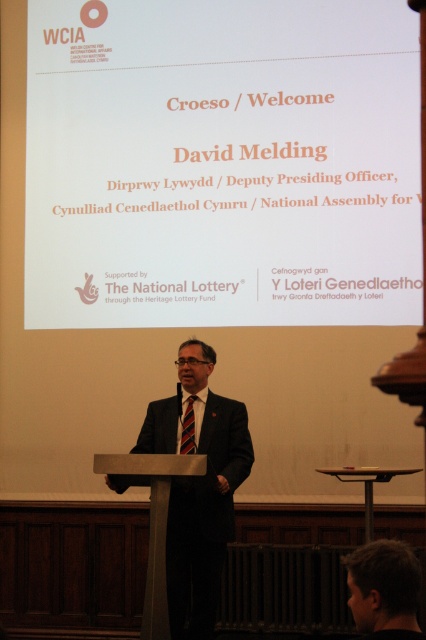
Question: Can you confirm if white paper at upper center is positioned above dark brown hair at lower right?

Choices:
 (A) yes
 (B) no

Answer: (A)

Question: Does white paper at upper center have a smaller size compared to metallic silver podium at center?

Choices:
 (A) no
 (B) yes

Answer: (A)

Question: Which object is positioned closest to the dark brown hair at lower right?

Choices:
 (A) white paper at upper center
 (B) black suit at center

Answer: (B)

Question: Which point is farther from the camera taking this photo?

Choices:
 (A) (351, 600)
 (B) (189, 412)

Answer: (B)

Question: Which is nearer to the metallic silver podium at center?

Choices:
 (A) striped fabric tie at center
 (B) white paper at upper center
 (C) black suit at center

Answer: (C)

Question: Does dark brown hair at lower right have a smaller size compared to striped fabric tie at center?

Choices:
 (A) no
 (B) yes

Answer: (A)